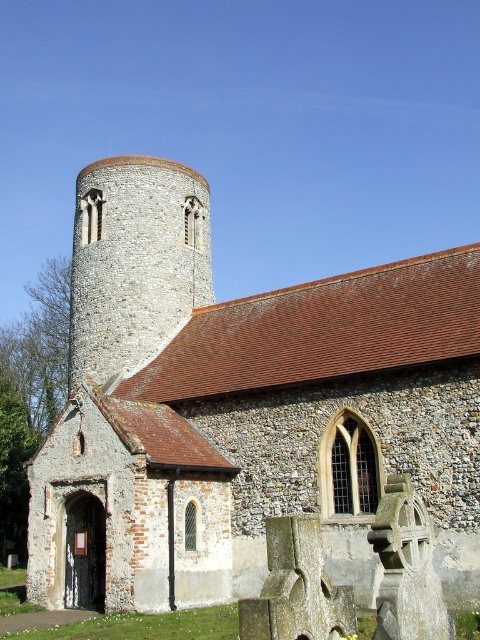
Question: Among these points, which one is farthest from the camera?

Choices:
 (A) (450, 280)
 (B) (124, 228)

Answer: (B)

Question: Can you confirm if stone church at center is positioned to the right of stone tower at center?

Choices:
 (A) no
 (B) yes

Answer: (B)

Question: Which point is closer to the camera taking this photo?

Choices:
 (A) (173, 547)
 (B) (204, 243)

Answer: (A)

Question: Does stone church at center have a lesser width compared to stone tower at center?

Choices:
 (A) no
 (B) yes

Answer: (A)

Question: Does stone church at center appear over stone tower at center?

Choices:
 (A) yes
 (B) no

Answer: (A)

Question: Which of the following is the closest to the observer?

Choices:
 (A) stone tower at center
 (B) stone church at center

Answer: (B)